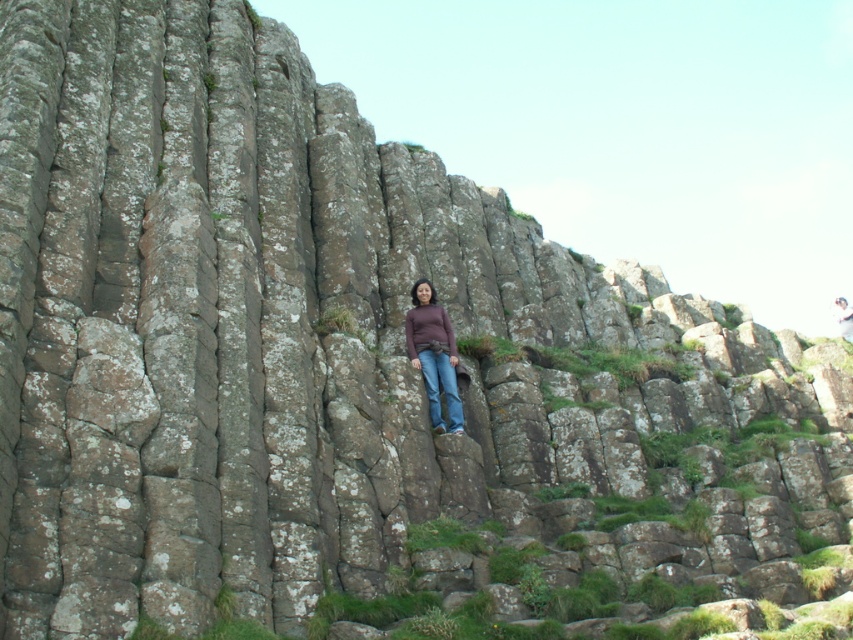
Is matte brown sweater at center bigger than matte brown hair at center?

Incorrect, matte brown sweater at center is not larger than matte brown hair at center.

This screenshot has width=853, height=640. Identify the location of matte brown sweater at center. (433, 355).